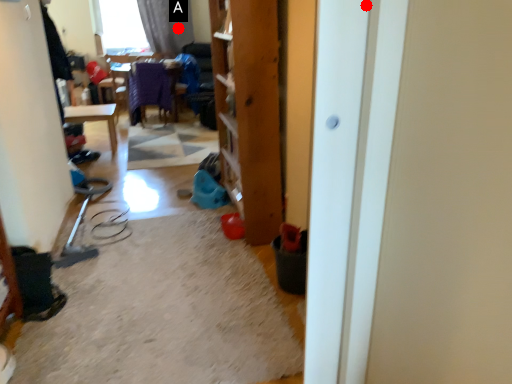
Question: Two points are circled on the image, labeled by A and B beside each circle. Which point appears farthest from the camera in this image?

Choices:
 (A) A is further
 (B) B is further

Answer: (A)